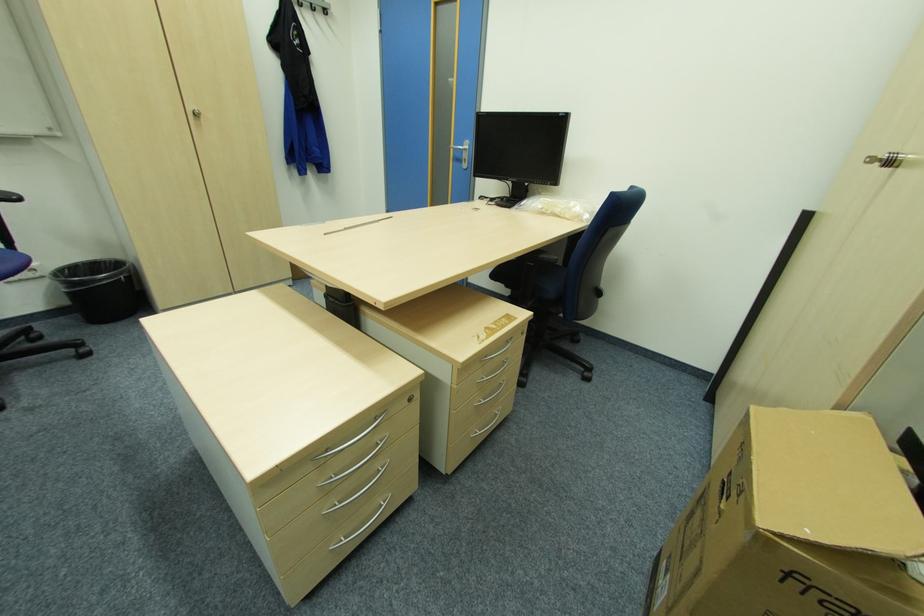
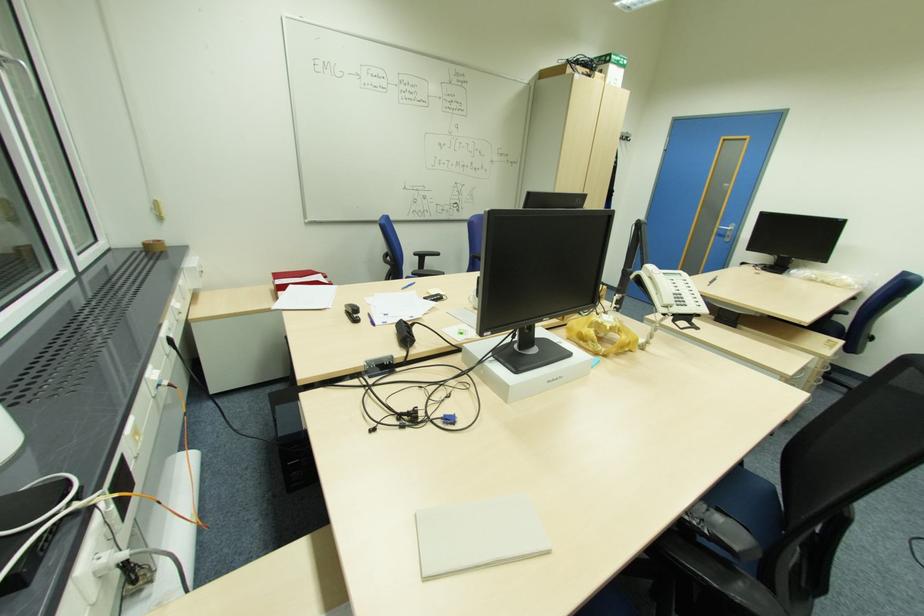
Where in the second image is the point corresponding to (x=468, y=159) from the first image?

(732, 236)